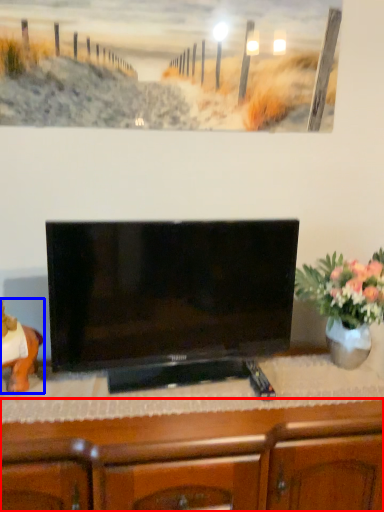
Question: Among these objects, which one is farthest to the camera, cabinetry (highlighted by a red box) or animal (highlighted by a blue box)?

Choices:
 (A) cabinetry
 (B) animal

Answer: (B)